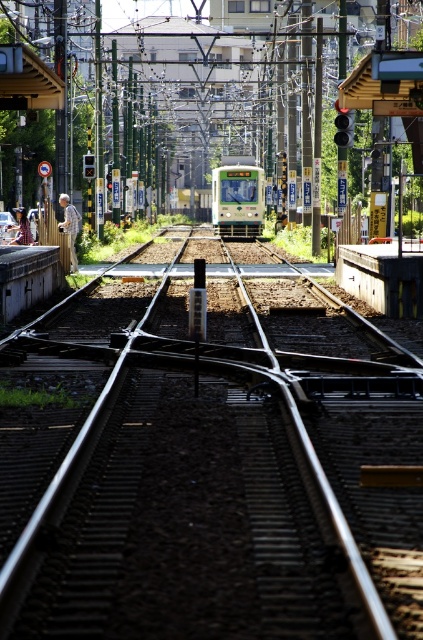
Does metallic train tracks at center have a lesser width compared to green matte train at center?

In fact, metallic train tracks at center might be wider than green matte train at center.

Which of these two, metallic train tracks at center or green matte train at center, stands shorter?

metallic train tracks at center is shorter.

Which is behind, point (125, 604) or point (246, 227)?

The point (246, 227) is behind.

This screenshot has width=423, height=640. I want to click on metallic train tracks at center, so click(x=222, y=470).